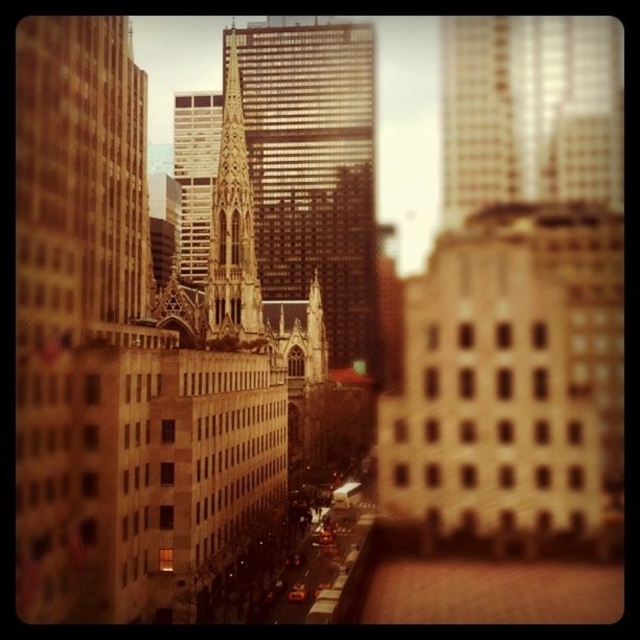
You are a drone operator trying to navigate a drone to the golden stone cathedral at center. According to the coordinates provided, where should you direct the drone to land?

The golden stone cathedral at center is located at point (314, 172), so you should direct the drone to land at those coordinates.